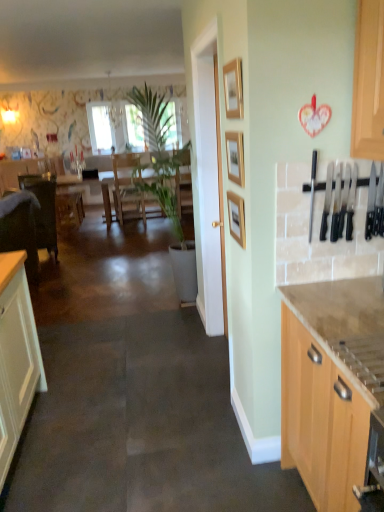
Measure the distance between wooden picture frame at upper center, the 3th picture frame positioned from the bottom, and camera.

wooden picture frame at upper center, the 3th picture frame positioned from the bottom, is 5.60 feet away from camera.

This screenshot has width=384, height=512. What do you see at coordinates (235, 157) in the screenshot?
I see `wooden picture frame at upper center, acting as the second picture frame starting from the top` at bounding box center [235, 157].

I want to click on wooden picture frame at upper center, the 3th picture frame positioned from the bottom, so 233,89.

Would you say light wood cabinet at right is inside or outside wooden table at center?

light wood cabinet at right exists outside the volume of wooden table at center.

Can you tell me how much light wood cabinet at right and wooden table at center differ in facing direction?

The angular difference between light wood cabinet at right and wooden table at center is 90.9 degrees.

Is light wood cabinet at right touching wooden table at center?

No, light wood cabinet at right is not in contact with wooden table at center.

Could you tell me if light wood cabinet at right is facing wooden table at center?

No.

Looking at this image, is transparent glass window at center thinner than light wood cabinet at right?

Yes, transparent glass window at center is thinner than light wood cabinet at right.

Between transparent glass window at center and light wood cabinet at right, which one has smaller size?

With smaller size is transparent glass window at center.

Which object is further away from the camera, transparent glass window at center or light wood cabinet at right?

transparent glass window at center is behind.

Based on the photo, considering the relative sizes of light wood cabinet at right and transparent glass window at center in the image provided, is light wood cabinet at right wider than transparent glass window at center?

Correct, the width of light wood cabinet at right exceeds that of transparent glass window at center.

Considering the relative sizes of light wood cabinet at right and transparent glass window at center in the image provided, is light wood cabinet at right shorter than transparent glass window at center?

Yes, light wood cabinet at right is shorter than transparent glass window at center.

Identify the location of window screen above the light wood cabinet at right (from the image's perspective). Image resolution: width=384 pixels, height=512 pixels. (100, 128).

Is light wood cabinet at right touching transparent glass window at center?

No, light wood cabinet at right is not making contact with transparent glass window at center.

Is wooden picture frame at upper center, marked as the 1th picture frame in a top-to-bottom arrangement, next to wooden picture frame at upper center, the 2th picture frame from the bottom, and touching it?

wooden picture frame at upper center, marked as the 1th picture frame in a top-to-bottom arrangement, is not next to wooden picture frame at upper center, the 2th picture frame from the bottom, and they're not touching.

Which object is wider, wooden picture frame at upper center, marked as the 1th picture frame in a top-to-bottom arrangement, or wooden picture frame at upper center, acting as the second picture frame starting from the top?

wooden picture frame at upper center, acting as the second picture frame starting from the top, is wider.

Can you confirm if wooden picture frame at upper center, the 3th picture frame positioned from the bottom, is positioned to the right of wooden picture frame at upper center, acting as the second picture frame starting from the top?

No.

Considering the positions of objects wooden picture frame at upper center, marked as the 1th picture frame in a top-to-bottom arrangement, and wooden picture frame at upper center, acting as the second picture frame starting from the top, in the image provided, who is behind, wooden picture frame at upper center, marked as the 1th picture frame in a top-to-bottom arrangement, or wooden picture frame at upper center, acting as the second picture frame starting from the top,?

wooden picture frame at upper center, acting as the second picture frame starting from the top.

Is wooden picture frame at upper center, acting as the second picture frame starting from the top, further to the viewer compared to light wood cabinet at right?

Yes, wooden picture frame at upper center, acting as the second picture frame starting from the top, is further from the viewer.

From a real-world perspective, between wooden picture frame at upper center, the 2th picture frame from the bottom, and light wood cabinet at right, who is vertically lower?

From a 3D spatial view, light wood cabinet at right is below.

Considering the sizes of objects wooden picture frame at upper center, acting as the second picture frame starting from the top, and light wood cabinet at right in the image provided, who is bigger, wooden picture frame at upper center, acting as the second picture frame starting from the top, or light wood cabinet at right?

Bigger between the two is light wood cabinet at right.

Does point (232, 173) lie behind point (310, 477)?

That is True.

Is wooden picture frame at center, positioned as the third picture frame in top-to-bottom order, inside or outside of wooden picture frame at upper center, acting as the second picture frame starting from the top?

wooden picture frame at center, positioned as the third picture frame in top-to-bottom order, is outside wooden picture frame at upper center, acting as the second picture frame starting from the top.

Can you confirm if wooden picture frame at center, the first picture frame ordered from the bottom, is shorter than wooden picture frame at upper center, the 2th picture frame from the bottom?

Incorrect, the height of wooden picture frame at center, the first picture frame ordered from the bottom, does not fall short of that of wooden picture frame at upper center, the 2th picture frame from the bottom.

Can you confirm if wooden picture frame at center, the first picture frame ordered from the bottom, is thinner than wooden picture frame at upper center, acting as the second picture frame starting from the top?

Yes, wooden picture frame at center, the first picture frame ordered from the bottom, is thinner than wooden picture frame at upper center, acting as the second picture frame starting from the top.

Where is `picture frame below the wooden picture frame at upper center, the 2th picture frame from the bottom (from the image's perspective)`? picture frame below the wooden picture frame at upper center, the 2th picture frame from the bottom (from the image's perspective) is located at coordinates (236, 218).

Is point (234, 76) positioned in front of point (363, 423)?

No, it is not.

Considering the relative sizes of wooden picture frame at upper center, the 3th picture frame positioned from the bottom, and light wood cabinet at right in the image provided, is wooden picture frame at upper center, the 3th picture frame positioned from the bottom, bigger than light wood cabinet at right?

No.

Is the surface of wooden picture frame at upper center, marked as the 1th picture frame in a top-to-bottom arrangement, in direct contact with light wood cabinet at right?

No, wooden picture frame at upper center, marked as the 1th picture frame in a top-to-bottom arrangement, is not beside light wood cabinet at right.

What's the angular difference between wooden picture frame at upper center, marked as the 1th picture frame in a top-to-bottom arrangement, and light wood cabinet at right's facing directions?

There is a 0.87-degree angle between the facing directions of wooden picture frame at upper center, marked as the 1th picture frame in a top-to-bottom arrangement, and light wood cabinet at right.

The height and width of the screenshot is (512, 384). In the image, there is a wooden table at center. Find the location of `cabinetry below it (from the image's perspective)`. cabinetry below it (from the image's perspective) is located at coordinates (321, 419).

I want to click on cabinetry lying on the right of transparent glass window at center, so click(x=321, y=419).

Which object lies nearer to the anchor point light wood cabinet at right, wooden picture frame at upper center, the 2th picture frame from the bottom, or transparent glass window at center?

The object closer to light wood cabinet at right is wooden picture frame at upper center, the 2th picture frame from the bottom.

From the image, which object appears to be farther from wooden picture frame at upper center, the 3th picture frame positioned from the bottom, wooden table at center or wooden picture frame at center, positioned as the third picture frame in top-to-bottom order?

wooden table at center is further to wooden picture frame at upper center, the 3th picture frame positioned from the bottom.

Looking at the image, which one is located closer to wooden picture frame at center, positioned as the third picture frame in top-to-bottom order, wooden picture frame at upper center, acting as the second picture frame starting from the top, or transparent glass window at center?

wooden picture frame at upper center, acting as the second picture frame starting from the top, is positioned closer to the anchor wooden picture frame at center, positioned as the third picture frame in top-to-bottom order.

Looking at the image, which one is located closer to wooden picture frame at center, the first picture frame ordered from the bottom, transparent glass window at center or light wood cabinet at right?

light wood cabinet at right lies closer to wooden picture frame at center, the first picture frame ordered from the bottom, than the other object.

Which object lies nearer to the anchor point wooden picture frame at center, the first picture frame ordered from the bottom, wooden table at center or light wood cabinet at right?

Among the two, light wood cabinet at right is located nearer to wooden picture frame at center, the first picture frame ordered from the bottom.

Which object lies further to the anchor point wooden table at center, transparent glass window at center or wooden picture frame at upper center, marked as the 1th picture frame in a top-to-bottom arrangement?

wooden picture frame at upper center, marked as the 1th picture frame in a top-to-bottom arrangement, is positioned further to the anchor wooden table at center.

Which object lies nearer to the anchor point wooden picture frame at upper center, the 2th picture frame from the bottom, light wood cabinet at right or wooden table at center?

The object closer to wooden picture frame at upper center, the 2th picture frame from the bottom, is light wood cabinet at right.

When comparing their distances from wooden table at center, does wooden picture frame at upper center, acting as the second picture frame starting from the top, or wooden picture frame at center, the first picture frame ordered from the bottom, seem further?

→ wooden picture frame at upper center, acting as the second picture frame starting from the top, is further to wooden table at center.

Identify the location of picture frame that lies between wooden picture frame at upper center, the 3th picture frame positioned from the bottom, and wooden picture frame at center, positioned as the third picture frame in top-to-bottom order, from top to bottom. (235, 157).

At what (x,y) coordinates should I click in order to perform the action: click on table positioned between wooden picture frame at upper center, the 2th picture frame from the bottom, and transparent glass window at center from near to far. Please return your answer as a coordinate pair (x, y). The image size is (384, 512). Looking at the image, I should click on (184, 189).

Identify the location of table between wooden picture frame at upper center, the 3th picture frame positioned from the bottom, and transparent glass window at center in the front-back direction. This screenshot has height=512, width=384. [x=184, y=189].

Where is `table located between wooden picture frame at center, positioned as the third picture frame in top-to-bottom order, and transparent glass window at center in the depth direction`? table located between wooden picture frame at center, positioned as the third picture frame in top-to-bottom order, and transparent glass window at center in the depth direction is located at coordinates (184, 189).